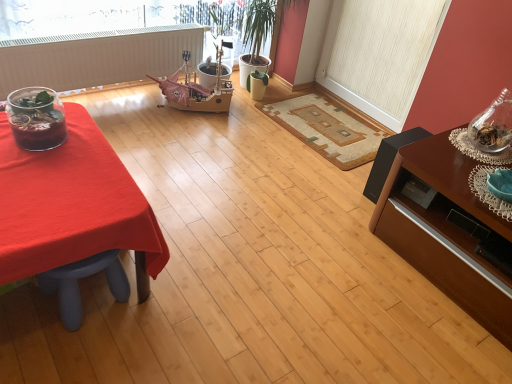
I want to click on free space on the front side of beige woven mat at center, so click(294, 180).